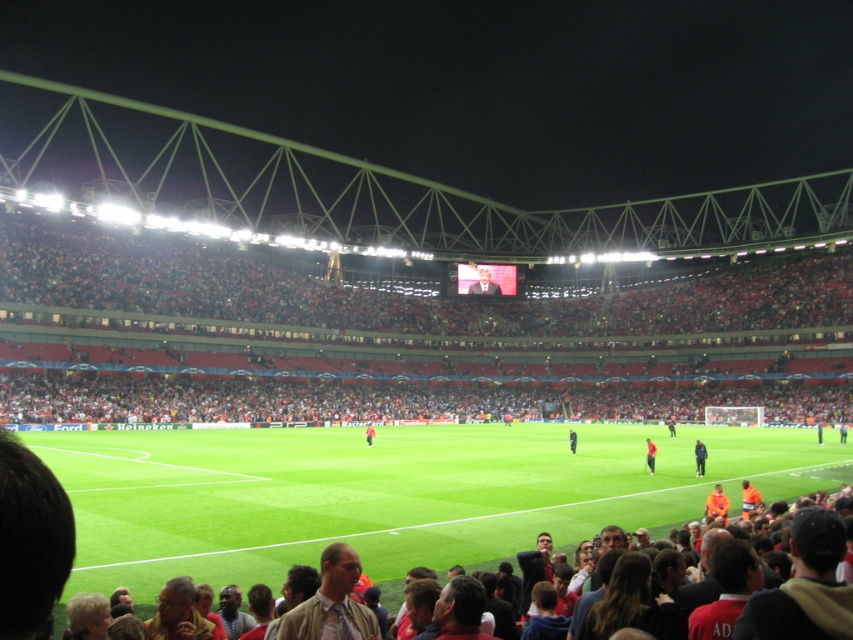
You are a drone operator trying to capture aerial footage of the soccer stadium. You have two points marked on your screen for camera positioning. The first point is at coordinates point (273, 464) and the second is at point (704, 458). From the perspective of someone standing at the center of the field, which point is closer to the front of the stadium?

Point (704, 458) is closer to the front of the stadium because it is in front of point (273, 464), which is behind it.

You are a photographer at the soccer stadium. You want to take a photo of the orange shirt at center and orange jersey at center. Which one is positioned higher in the image?

The orange shirt at center is located above the orange jersey at center, so it is positioned higher in the image.

In the scene shown: You are a drone operator trying to capture aerial footage of the soccer stadium. Your drone has a maximum flight range of 200 feet from its control point. If you position yourself at the smooth skin face at center, can your drone reach the green grass football field at lower center without exceeding its range?

The distance between the green grass football field at lower center and the smooth skin face at center is 203.01 feet, which exceeds the drone operator drone maximum flight range of 200 feet. Therefore, the drone cannot reach the green grass football field at lower center without exceeding its range.